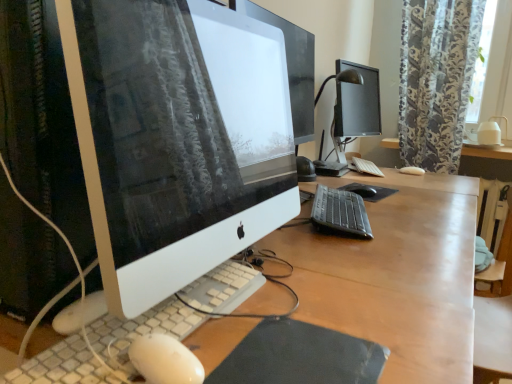
This screenshot has height=384, width=512. I want to click on empty space that is ontop of black rubber mousepad at center, the second mousepad when ordered from left to right (from a real-world perspective), so click(x=358, y=184).